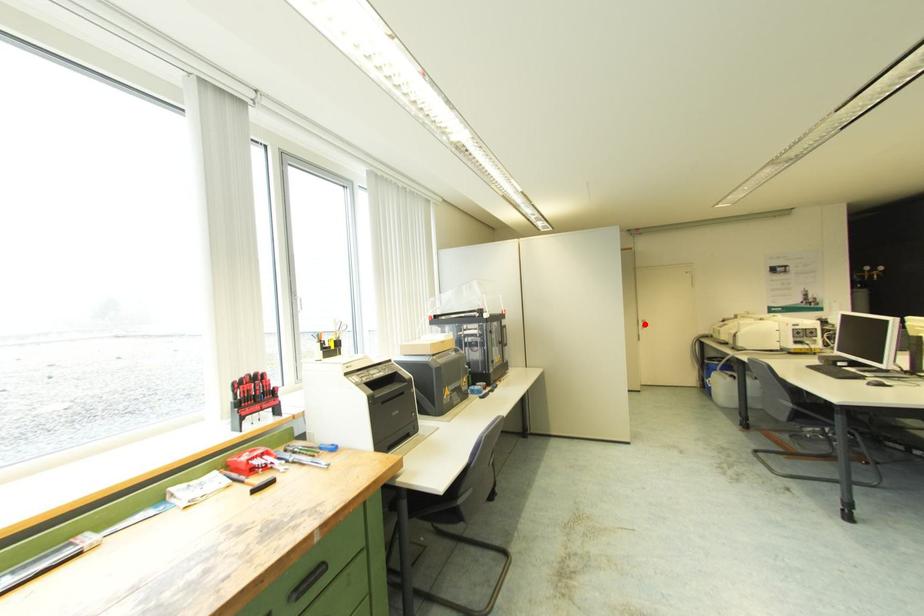
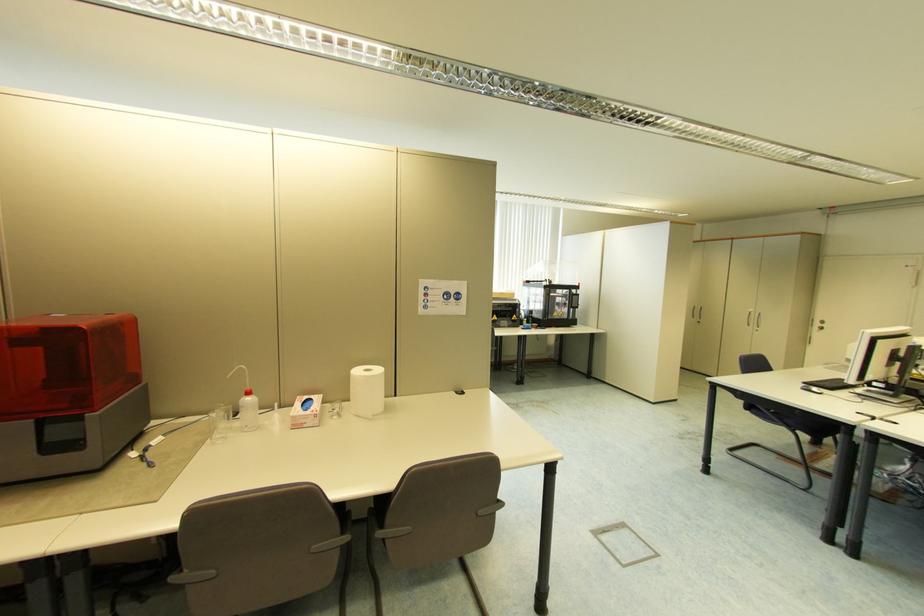
Question: I am providing you with two images of the same scene from different viewpoints. A red point is marked on the first image. Is the red point's position out of view in image 2?

Choices:
 (A) Yes
 (B) No

Answer: (B)